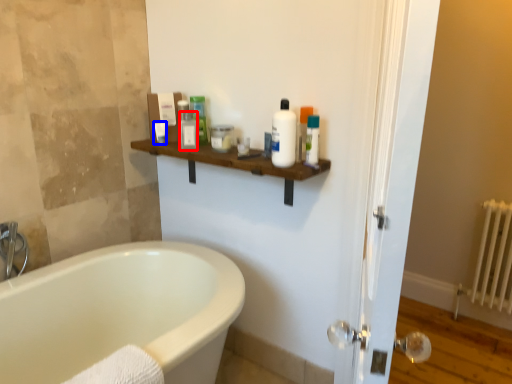
Question: Among these objects, which one is farthest to the camera, toiletry (highlighted by a red box) or toiletry (highlighted by a blue box)?

Choices:
 (A) toiletry
 (B) toiletry

Answer: (B)